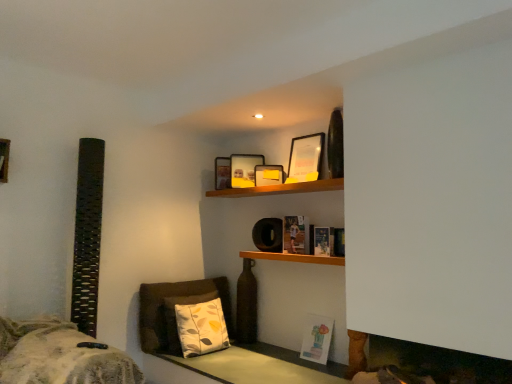
Question: Is matte paper book at center, marked as the 3th book in a bottom-to-top arrangement, inside matte yellow picture frame at upper center, which is the second picture frame from right to left?

Choices:
 (A) yes
 (B) no

Answer: (B)

Question: Is matte yellow picture frame at upper center, which is the second picture frame from right to left, far away from matte paper book at center, marked as the 3th book in a bottom-to-top arrangement?

Choices:
 (A) yes
 (B) no

Answer: (B)

Question: Is matte yellow picture frame at upper center, the second picture frame when ordered from left to right, smaller than matte paper book at center, which is counted as the 1th book, starting from the top?

Choices:
 (A) no
 (B) yes

Answer: (B)

Question: From a real-world perspective, is matte yellow picture frame at upper center, the 2th picture frame from the back, over matte paper book at center, which is counted as the 1th book, starting from the top?

Choices:
 (A) yes
 (B) no

Answer: (A)

Question: Does matte yellow picture frame at upper center, which is the second picture frame from right to left, have a lesser height compared to matte paper book at center, marked as the 3th book in a bottom-to-top arrangement?

Choices:
 (A) yes
 (B) no

Answer: (A)

Question: Considering the positions of point (164, 359) and point (198, 314), is point (164, 359) closer or farther from the camera than point (198, 314)?

Choices:
 (A) farther
 (B) closer

Answer: (B)

Question: Considering the positions of smooth wooden table at lower center and white fabric pillow at lower center in the image, is smooth wooden table at lower center wider or thinner than white fabric pillow at lower center?

Choices:
 (A) thin
 (B) wide

Answer: (B)

Question: From the image's perspective, is smooth wooden table at lower center above or below white fabric pillow at lower center?

Choices:
 (A) above
 (B) below

Answer: (B)

Question: From a real-world perspective, is smooth wooden table at lower center above or below white fabric pillow at lower center?

Choices:
 (A) below
 (B) above

Answer: (A)

Question: From their relative heights in the image, would you say matte yellow picture frame at upper center, the 2th picture frame from the back, is taller or shorter than fuzzy gray blanket at lower left?

Choices:
 (A) short
 (B) tall

Answer: (A)

Question: Considering the positions of matte yellow picture frame at upper center, which is the second picture frame from right to left, and fuzzy gray blanket at lower left in the image, is matte yellow picture frame at upper center, which is the second picture frame from right to left, wider or thinner than fuzzy gray blanket at lower left?

Choices:
 (A) wide
 (B) thin

Answer: (B)

Question: Choose the correct answer: Is matte yellow picture frame at upper center, the 2th picture frame from the back, inside fuzzy gray blanket at lower left or outside it?

Choices:
 (A) inside
 (B) outside

Answer: (B)

Question: In the image, is matte yellow picture frame at upper center, which is the second picture frame from right to left, positioned in front of or behind fuzzy gray blanket at lower left?

Choices:
 (A) behind
 (B) front

Answer: (A)

Question: Is matte paper book at center, marked as the 3th book in a bottom-to-top arrangement, in front of or behind fuzzy gray blanket at lower left in the image?

Choices:
 (A) behind
 (B) front

Answer: (A)

Question: From a real-world perspective, is matte paper book at center, which is counted as the 1th book, starting from the top, above or below fuzzy gray blanket at lower left?

Choices:
 (A) above
 (B) below

Answer: (A)